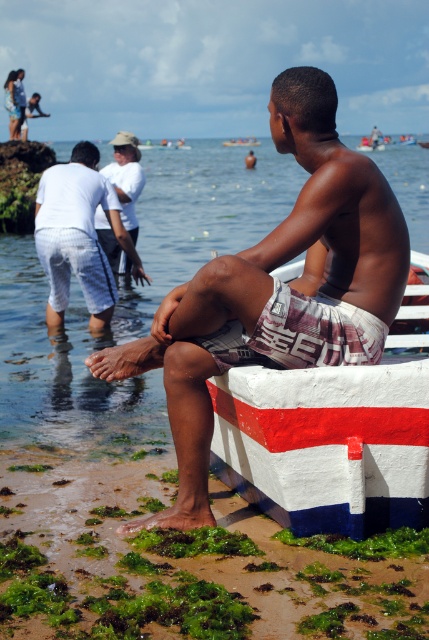
You are a photographer taking a picture of the beach scene. You notice the white textured shorts at center and the white painted wood boat at center. Which object should you focus on first if you want to capture the taller one in your shot?

The white textured shorts at center is taller than the white painted wood boat at center, so you should focus on the white textured shorts at center first to capture the taller object.

You are a photographer trying to capture a closeup of the white textured shorts at center and the white cotton shirt at upper left. Since you want to focus on both, which object should you zoom in on first to ensure they both fit in the frame?

The white textured shorts at center is wider than the white cotton shirt at upper left, so you should zoom in on the white cotton shirt at upper left first to ensure both fit in the frame.